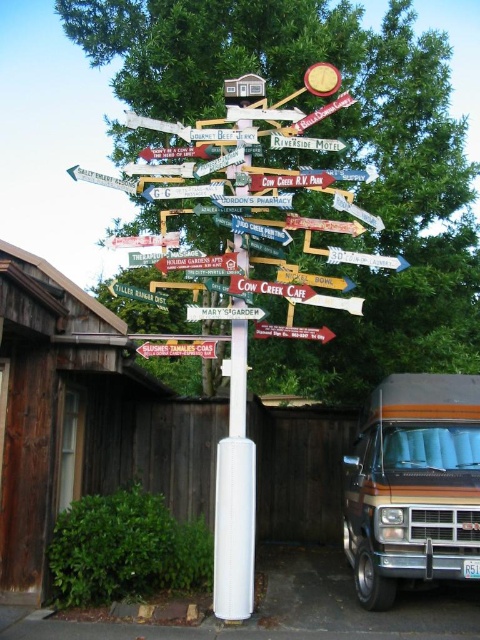
Who is more distant from viewer, (240, 531) or (144, 289)?

The point (144, 289) is behind.

Between white plastic pole at center and green painted wooden signpost at center, which one is positioned higher?

green painted wooden signpost at center is higher up.

The height and width of the screenshot is (640, 480). Describe the element at coordinates (235, 497) in the screenshot. I see `white plastic pole at center` at that location.

You are a GUI agent. You are given a task and a screenshot of the screen. Output one action in this format:
    pyautogui.click(x=<x>, y=<y>)
    Task: Click on the white plastic pole at center
    This screenshot has width=480, height=640.
    Given the screenshot: What is the action you would take?
    pyautogui.click(x=235, y=497)

Can you confirm if wooden signpost at center is taller than green painted wooden signpost at center?

Correct, wooden signpost at center is much taller as green painted wooden signpost at center.

Who is more forward, (155, 353) or (127, 289)?

Point (155, 353) is more forward.

At what (x,y) coordinates should I click in order to perform the action: click on wooden signpost at center. Please return your answer as a coordinate pair (x, y). Looking at the image, I should click on (178, 348).

Which is in front, point (233, 349) or point (199, 340)?

Point (233, 349) is in front.

Can you confirm if white plastic pole at center is shorter than wooden signpost at center?

No.

What do you see at coordinates (235, 497) in the screenshot? The height and width of the screenshot is (640, 480). I see `white plastic pole at center` at bounding box center [235, 497].

In order to click on white plastic pole at center in this screenshot , I will do `click(235, 497)`.